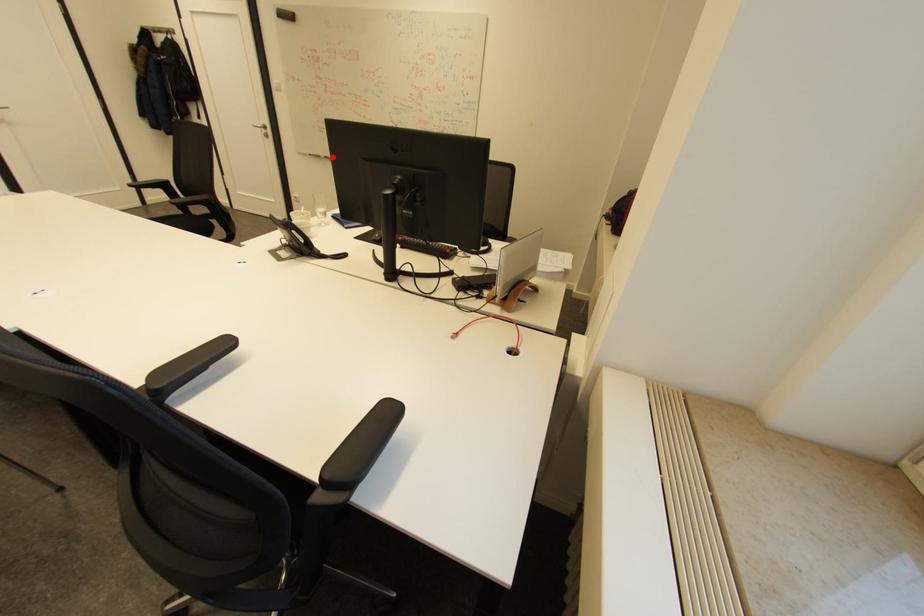
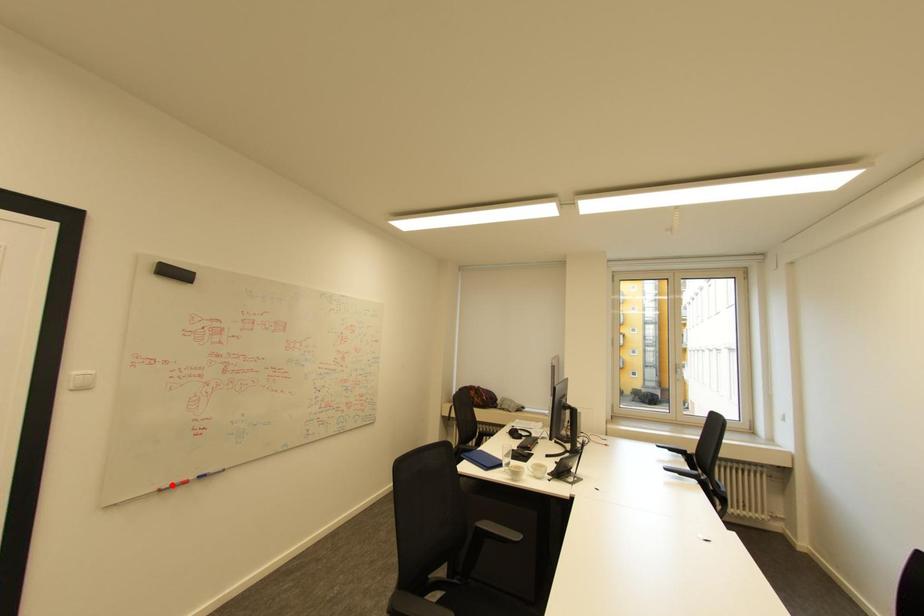
I am providing you with two images of the same scene from different viewpoints. A red point is marked on the first image and another point is marked on the second image. Does the point marked in image1 correspond to the same location as the one in image2?

No